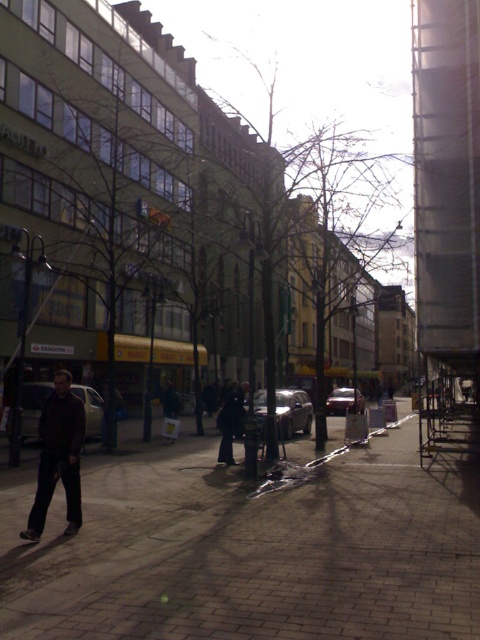
Question: Is brick pavement at center to the left of dark brown leather jacket at lower left from the viewer's perspective?

Choices:
 (A) yes
 (B) no

Answer: (B)

Question: Considering the relative positions of matte black car at center and shiny silver car at center in the image provided, where is matte black car at center located with respect to shiny silver car at center?

Choices:
 (A) above
 (B) below

Answer: (A)

Question: Which of the following is the closest to the observer?

Choices:
 (A) black leather pants at center
 (B) satin silver car at center
 (C) brick pavement at center
 (D) shiny silver car at center

Answer: (C)

Question: In this image, where is brick pavement at center located relative to dark brown leather jacket at lower left?

Choices:
 (A) above
 (B) below

Answer: (B)

Question: Which of the following is the closest to the observer?

Choices:
 (A) (356, 396)
 (B) (59, 378)
 (C) (294, 428)

Answer: (B)

Question: Which point is farther to the camera?

Choices:
 (A) (50, 454)
 (B) (347, 400)
 (C) (55, 512)

Answer: (B)